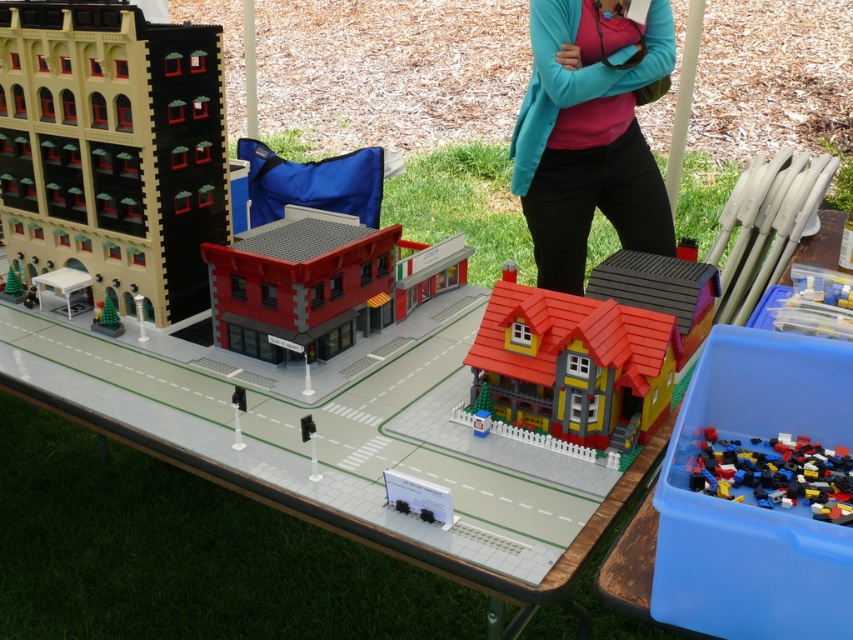
Question: Is teal fabric sweater at upper center wider than smooth red roof at center?

Choices:
 (A) yes
 (B) no

Answer: (A)

Question: Among these points, which one is nearest to the camera?

Choices:
 (A) (28, 196)
 (B) (119, 330)
 (C) (770, 499)

Answer: (C)

Question: Does matte yellow building at left have a larger size compared to green matte christmas tree at lower left?

Choices:
 (A) no
 (B) yes

Answer: (B)

Question: Among these objects, which one is farthest from the camera?

Choices:
 (A) matte yellow building at left
 (B) green matte christmas tree at lower left

Answer: (B)

Question: Observing the image, what is the correct spatial positioning of matte yellow building at left in reference to matte yellow house at center?

Choices:
 (A) left
 (B) right

Answer: (A)

Question: Which point is closer to the camera?

Choices:
 (A) teal fabric sweater at upper center
 (B) matte yellow building at left
 (C) brick-like plastic bricks at lower right

Answer: (C)